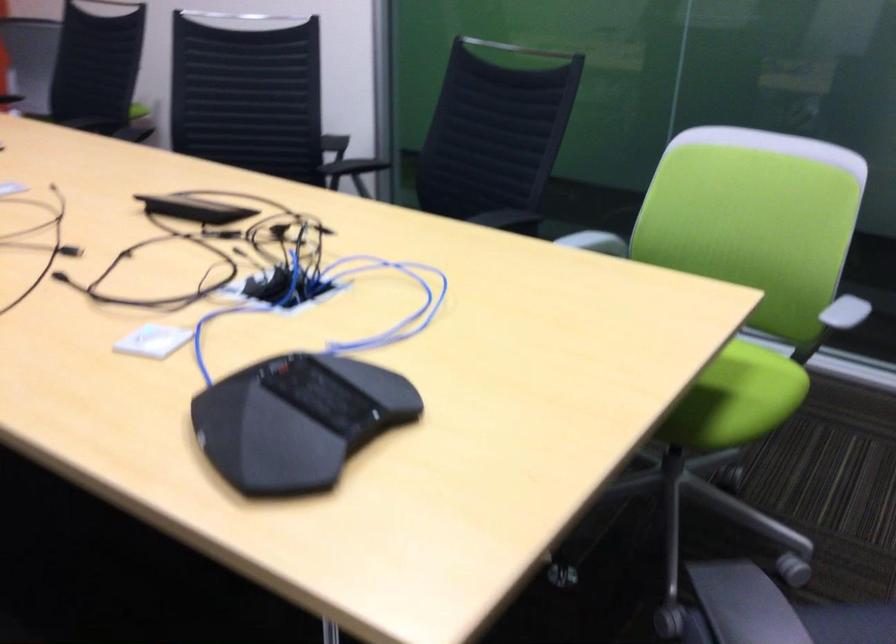
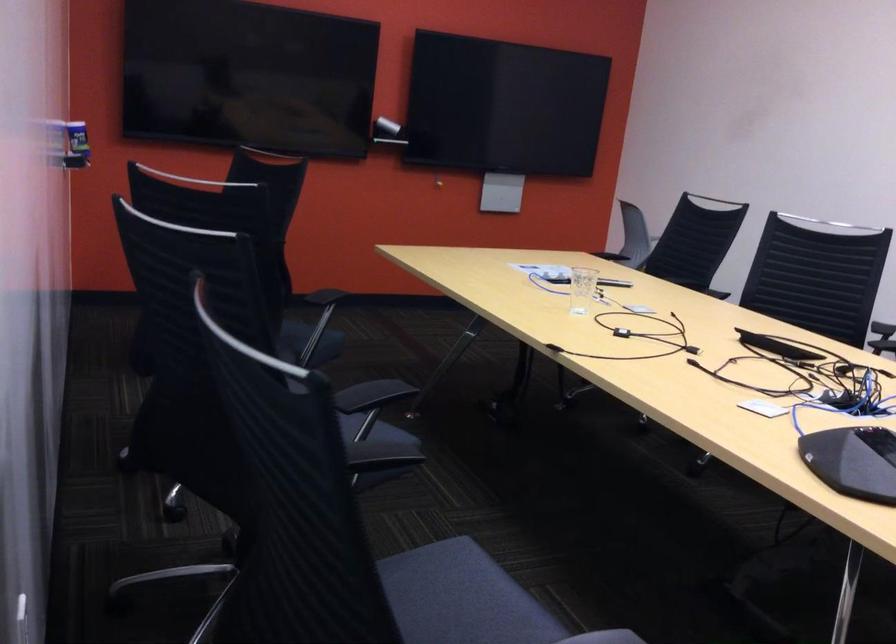
Question: The camera is either moving clockwise (left) or counter-clockwise (right) around the object. The first image is from the beginning of the video and the second image is from the end. Is the camera moving left or right when shooting the video?

Choices:
 (A) Left
 (B) Right

Answer: (B)